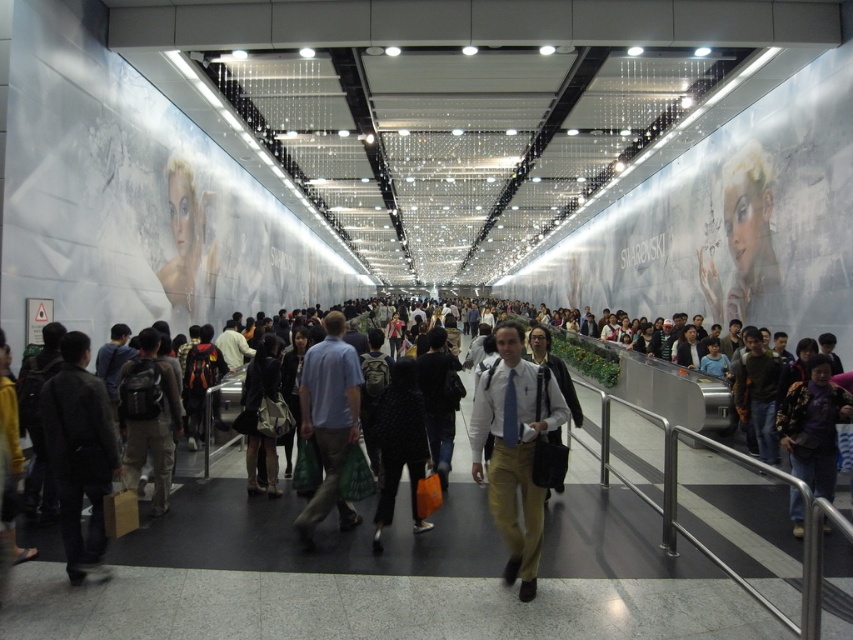
Question: Which of the following is the closest to the observer?

Choices:
 (A) (511, 541)
 (B) (378, 426)
 (C) (802, 509)
 (D) (310, 513)

Answer: (A)

Question: Which point is farther to the camera?

Choices:
 (A) dark gray jacket at center
 (B) light brown cotton pants at center
 (C) dark purple fabric jacket at center

Answer: (C)

Question: Which point is closer to the camera taking this photo?

Choices:
 (A) (328, 493)
 (B) (415, 524)
 (C) (531, 493)
 (D) (84, 556)

Answer: (C)

Question: Is dark gray jacket at center smaller than black dotted sweater at center?

Choices:
 (A) no
 (B) yes

Answer: (B)

Question: Is light brown cotton pants at center positioned at the back of dark gray jacket at center?

Choices:
 (A) yes
 (B) no

Answer: (B)

Question: From the image, what is the correct spatial relationship of dark gray jacket at center in relation to dark purple fabric jacket at center?

Choices:
 (A) above
 (B) below

Answer: (A)